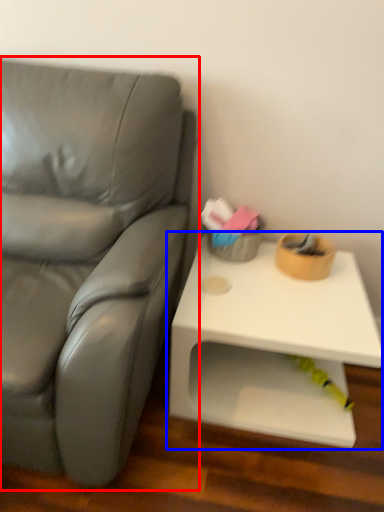
Question: Which object is closer to the camera taking this photo, studio couch (highlighted by a red box) or table (highlighted by a blue box)?

Choices:
 (A) studio couch
 (B) table

Answer: (A)